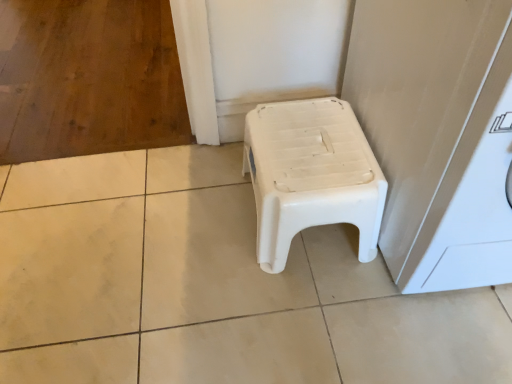
Question: Is white plastic stool at center wider or thinner than white plastic washing machine at right?

Choices:
 (A) thin
 (B) wide

Answer: (A)

Question: Which is correct: white plastic stool at center is inside white plastic washing machine at right, or outside of it?

Choices:
 (A) outside
 (B) inside

Answer: (A)

Question: Is white plastic stool at center bigger or smaller than white plastic washing machine at right?

Choices:
 (A) small
 (B) big

Answer: (A)

Question: Is point (488, 87) closer or farther from the camera than point (287, 142)?

Choices:
 (A) closer
 (B) farther

Answer: (A)

Question: From the image's perspective, is white plastic washing machine at right above or below white plastic stool at center?

Choices:
 (A) below
 (B) above

Answer: (B)

Question: Relative to white plastic stool at center, is white plastic washing machine at right in front or behind?

Choices:
 (A) front
 (B) behind

Answer: (A)

Question: In terms of height, does white plastic washing machine at right look taller or shorter compared to white plastic stool at center?

Choices:
 (A) tall
 (B) short

Answer: (A)